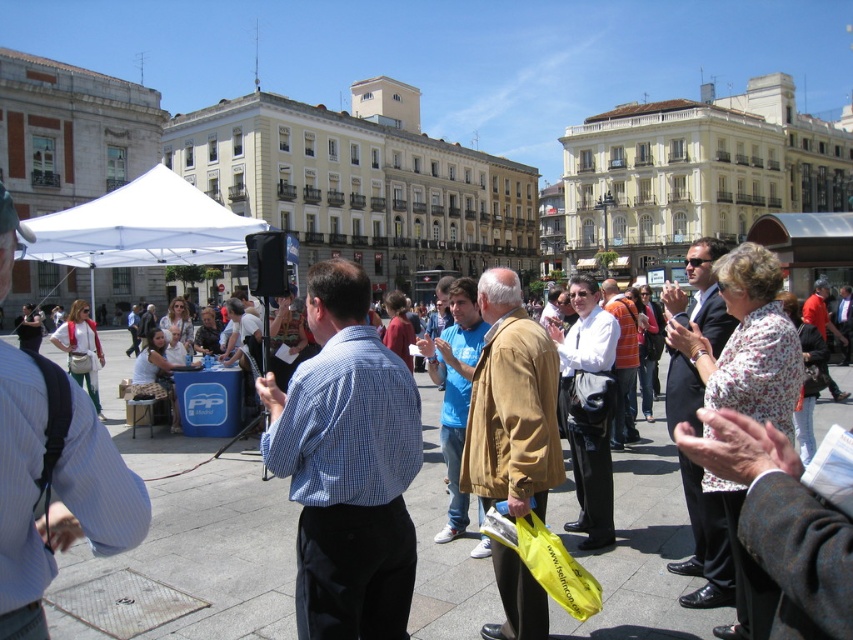
Question: Is blue checkered shirt at center smaller than white fabric canopy at upper left?

Choices:
 (A) no
 (B) yes

Answer: (B)

Question: Which point is closer to the camera?

Choices:
 (A) (155, 259)
 (B) (421, 452)

Answer: (B)

Question: Which object appears closest to the camera in this image?

Choices:
 (A) white fabric canopy at upper left
 (B) blue checkered shirt at center

Answer: (B)

Question: Considering the relative positions of blue checkered shirt at center and white fabric canopy at upper left in the image provided, where is blue checkered shirt at center located with respect to white fabric canopy at upper left?

Choices:
 (A) above
 (B) below

Answer: (B)

Question: Among these points, which one is nearest to the camera?

Choices:
 (A) (340, 516)
 (B) (113, 252)

Answer: (A)

Question: Is blue checkered shirt at center positioned behind white fabric canopy at upper left?

Choices:
 (A) yes
 (B) no

Answer: (B)